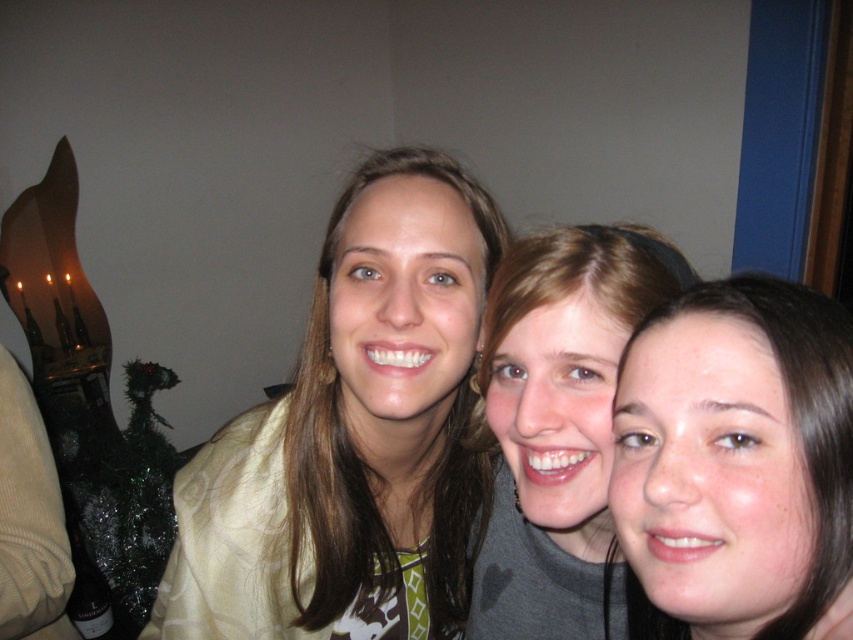
You are a photographer trying to adjust the lighting for a group photo. You notice two elements in the center of the image, the dark brown hair at center and the gray matte shirt at center. Which of these two elements is narrower in width?

The dark brown hair at center has a lesser width compared to the gray matte shirt at center, so the dark brown hair at center is narrower in width.

You are a photographer trying to adjust the lighting for a group photo. You notice two elements in the scene that need even illumination. Which of the two elements, the dark brown hair at center or the gray matte shirt at center, requires more focused lighting because it is smaller in size?

The dark brown hair at center requires more focused lighting because it has a smaller size compared to the gray matte shirt at center.